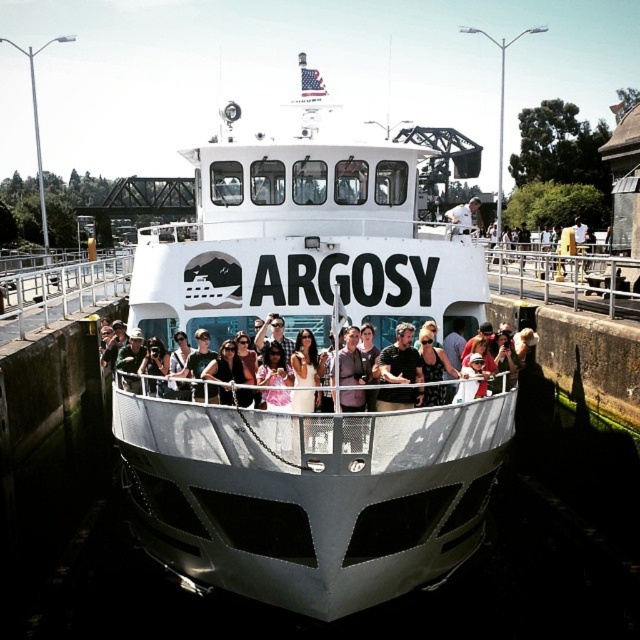
Is white matte boat at center shorter than matte black shirt at center?

Incorrect, white matte boat at center's height does not fall short of matte black shirt at center's.

Does point (284, 266) come behind point (134, 378)?

Yes, point (284, 266) is behind point (134, 378).

Where is `white matte boat at center`? The height and width of the screenshot is (640, 640). white matte boat at center is located at coordinates (307, 378).

Who is lower down, dark gray shirt at center or white fabric shirt at center?

Positioned lower is dark gray shirt at center.

Looking at this image, is dark gray shirt at center wider than white fabric shirt at center?

No.

Is point (404, 365) closer to viewer compared to point (445, 212)?

Yes, point (404, 365) is closer to viewer.

The height and width of the screenshot is (640, 640). I want to click on dark gray shirt at center, so click(401, 358).

Can you confirm if matte black shirt at center is smaller than dark gray shirt at center?

No.

Is matte black shirt at center further to the viewer compared to dark gray shirt at center?

No, it is not.

Who is more distant from viewer, (488, 324) or (413, 400)?

The point (488, 324) is more distant.

Image resolution: width=640 pixels, height=640 pixels. Identify the location of matte black shirt at center. (497, 355).